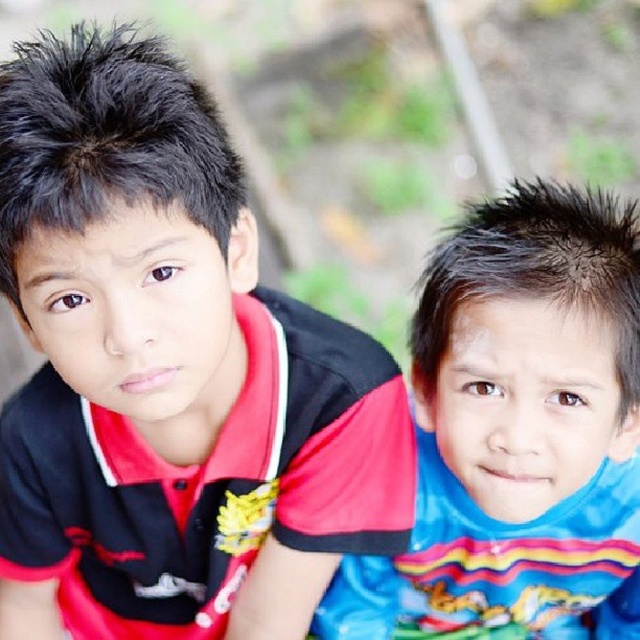
Image resolution: width=640 pixels, height=640 pixels. I want to click on red matte shirt at upper left, so click(x=170, y=372).

Who is more forward, (150, 316) or (634, 388)?

Point (150, 316) is in front.

This screenshot has width=640, height=640. In order to click on red matte shirt at upper left in this screenshot , I will do `click(170, 372)`.

Locate an element on the screen. red matte shirt at upper left is located at coordinates (170, 372).